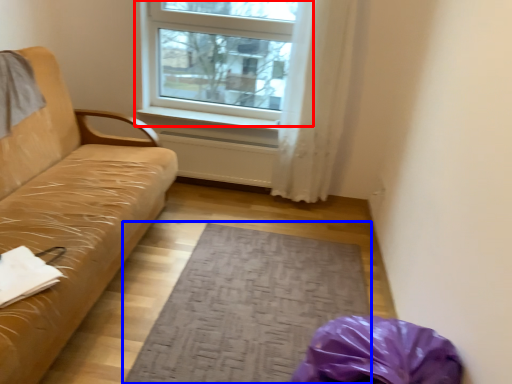
Question: Which of the following is the farthest to the observer, window (highlighted by a red box) or mat (highlighted by a blue box)?

Choices:
 (A) window
 (B) mat

Answer: (A)